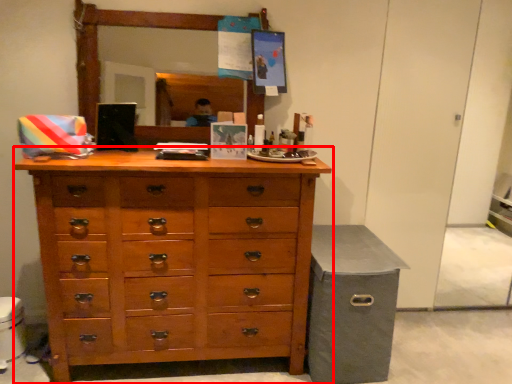
Question: From the image's perspective, what is the correct spatial relationship of chest of drawers (annotated by the red box) in relation to cabinetry?

Choices:
 (A) above
 (B) below

Answer: (A)